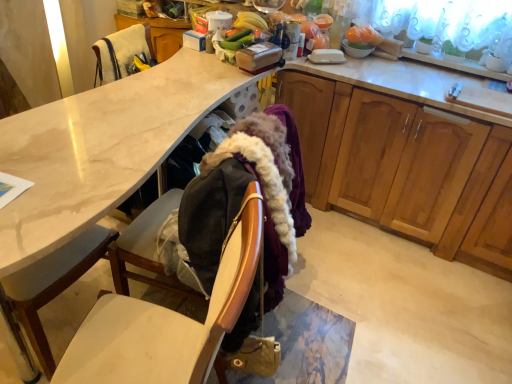
Question: From the image's perspective, is white glossy bowl at upper right located above or below wooden cabinets at right?

Choices:
 (A) below
 (B) above

Answer: (B)

Question: Is white glossy bowl at upper right in front of or behind wooden cabinets at right in the image?

Choices:
 (A) behind
 (B) front

Answer: (A)

Question: Which is nearer to the matte white cup at upper center?

Choices:
 (A) orange plastic bag at upper right
 (B) green matte plant at upper right
 (C) velvet-like fabric armchair at upper left
 (D) matte white desk at center
 (E) wooden chair at lower left

Answer: (C)

Question: Estimate the real-world distances between objects in this image. Which object is closer to the wooden chair at lower left?

Choices:
 (A) matte white cup at upper center
 (B) green matte plant at upper right
 (C) matte white desk at center
 (D) white glossy bowl at upper right
 (E) wooden cabinets at right

Answer: (C)